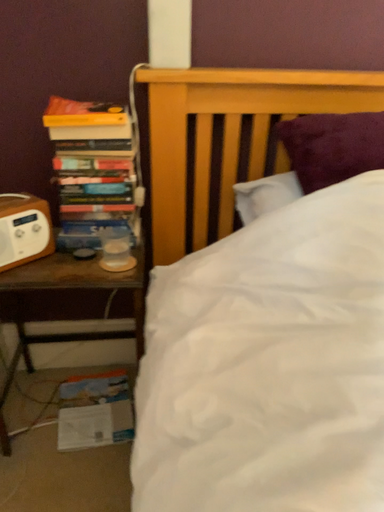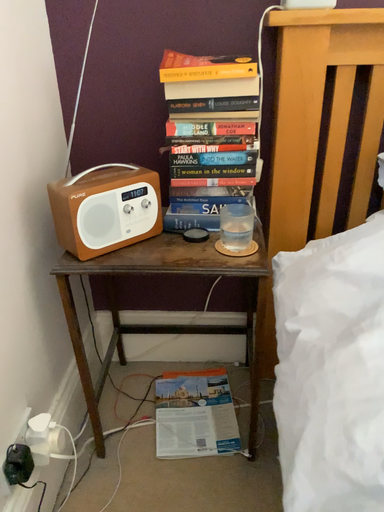
Question: Which way did the camera rotate in the video?

Choices:
 (A) rotated right
 (B) rotated left

Answer: (B)